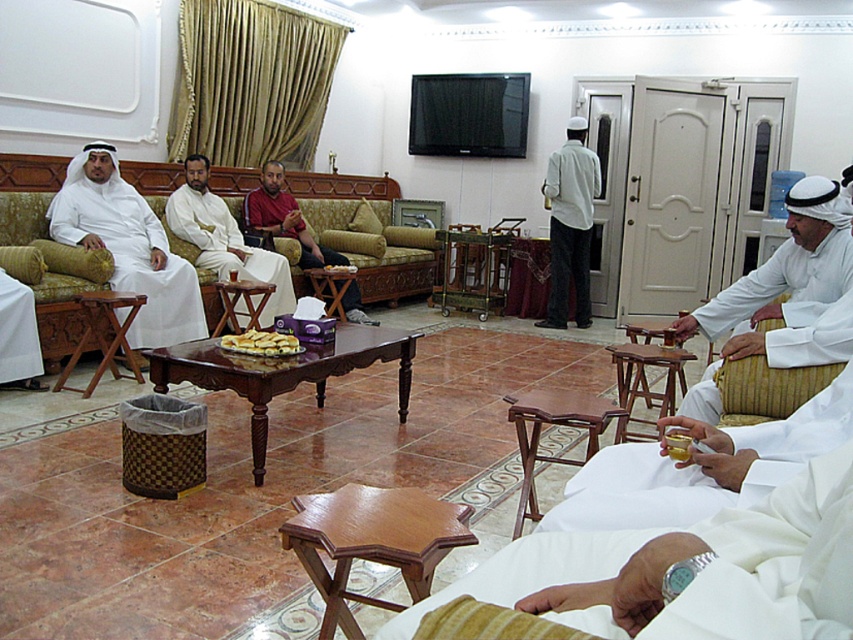
Between matte white robe at center and wooden folding table at lower center, which one is positioned higher?

matte white robe at center

Which is behind, point (199, 209) or point (606, 410)?

The point (199, 209) is behind.

You are a GUI agent. You are given a task and a screenshot of the screen. Output one action in this format:
    pyautogui.click(x=<x>, y=<y>)
    Task: Click on the matte white robe at center
    
    Given the screenshot: What is the action you would take?
    pyautogui.click(x=224, y=240)

In the scene shown: Can you confirm if woodenwoodentable at center is smaller than golden baked bread at center?

No.

Does woodenwoodentable at center appear on the left side of golden baked bread at center?

Correct, you'll find woodenwoodentable at center to the left of golden baked bread at center.

Does point (352, 284) lie behind point (259, 349)?

Yes, point (352, 284) is farther from viewer.

Identify the location of woodenwoodentable at center. Image resolution: width=853 pixels, height=640 pixels. (334, 285).

Does white woven drum at right come in front of golden brown pastry at center?

Yes.

Which is more to the right, white woven drum at right or golden brown pastry at center?

Positioned to the right is white woven drum at right.

At what (x,y) coordinates should I click in order to perform the action: click on white woven drum at right. Please return your answer as a coordinate pair (x, y). Looking at the image, I should click on (782, 292).

Locate an element on the screen. This screenshot has height=640, width=853. white woven drum at right is located at coordinates (782, 292).